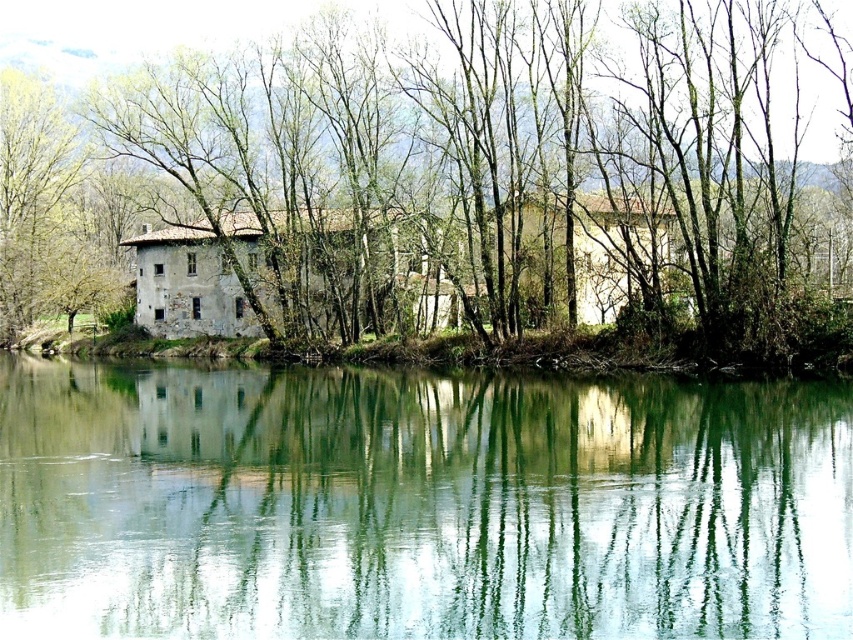
Consider the image. You are standing at the riverside and see two points marked in the image. The first point is at coordinate point [654,428], and the second is at point [39,17]. Which point is closer to you?

Point [654,428] is in front of point [39,17], so the first point is closer to you.